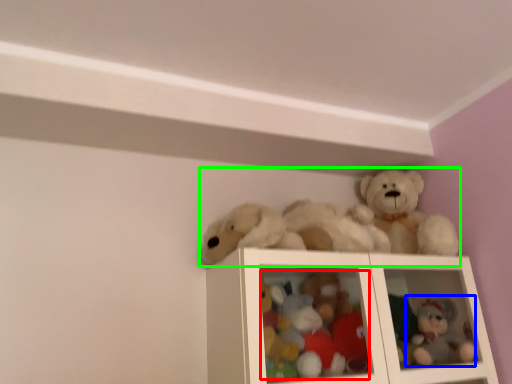
Question: Which object is positioned closest to toy (highlighted by a red box)? Select from toy (highlighted by a blue box) and toy (highlighted by a green box).

Choices:
 (A) toy
 (B) toy

Answer: (B)